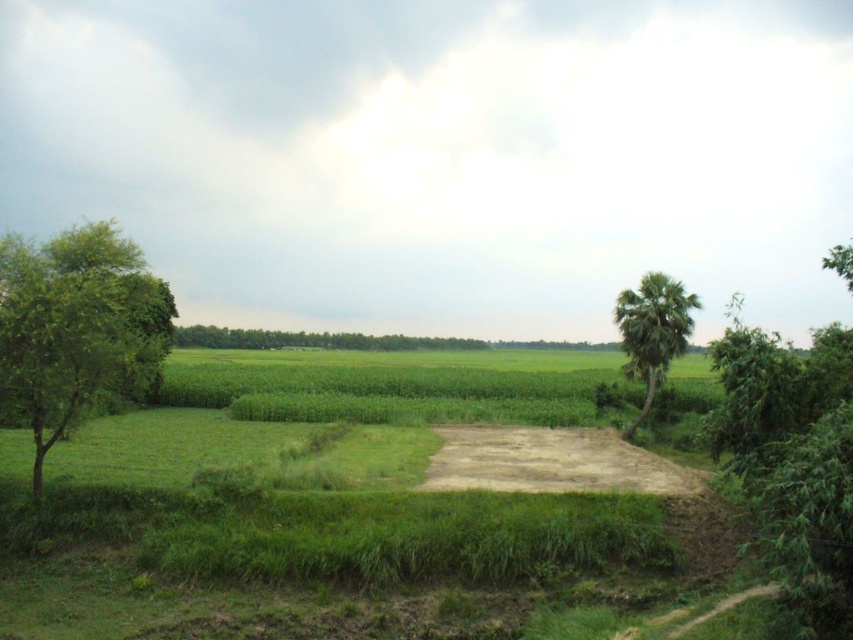
You are a bird looking for a nesting spot. You see the green leafy tree at left and the green leafy tree at center. Which tree would be better for nesting if you prefer taller trees?

The green leafy tree at left is much taller than the green leafy tree at center, so it would be better for nesting if you prefer taller trees.

You are standing at the camera position and want to walk directly towards the green leafy tree at left. How far will you have to walk to reach it?

The distance of green leafy tree at left from camera is 16.45 meters, so you will have to walk 16.45 meters to reach it.